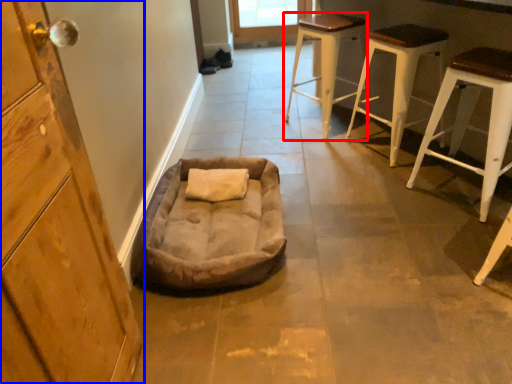
Question: Which object appears farthest to the camera in this image, stool (highlighted by a red box) or cabinetry (highlighted by a blue box)?

Choices:
 (A) stool
 (B) cabinetry

Answer: (A)